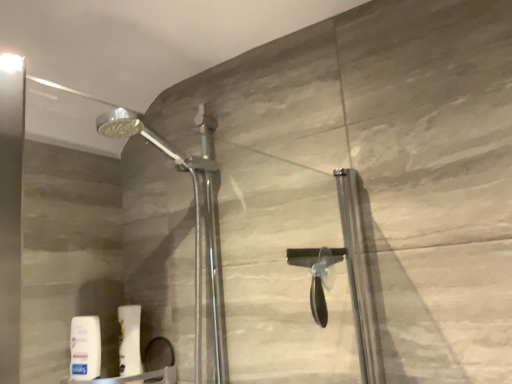
Measure the distance between point (345, 228) and camera.

37.24 inches.

This screenshot has width=512, height=384. Identify the location of transparent glass door at center. (275, 262).

In terms of width, does white matte tube at lower left, the second toiletry in the left-to-right sequence, look wider or thinner when compared to transparent glass door at center?

Considering their sizes, white matte tube at lower left, the second toiletry in the left-to-right sequence, looks slimmer than transparent glass door at center.

Is white matte tube at lower left, the second toiletry in the left-to-right sequence, with transparent glass door at center?

No, white matte tube at lower left, the second toiletry in the left-to-right sequence, is not with transparent glass door at center.

Does point (126, 322) appear closer or farther from the camera than point (149, 221)?

Clearly, point (126, 322) is closer to the camera than point (149, 221).

Is white matte tube at lower left, the first toiletry positioned from the right, positioned beyond the bounds of transparent glass door at center?

white matte tube at lower left, the first toiletry positioned from the right, is positioned outside transparent glass door at center.

Considering the relative positions of white matte tube at lower left, the first toiletry positioned from the right, and white matte lotion at lower left, which is the second toiletry in right-to-left order, in the image provided, is white matte tube at lower left, the first toiletry positioned from the right, behind white matte lotion at lower left, which is the second toiletry in right-to-left order,?

Yes, white matte tube at lower left, the first toiletry positioned from the right, is further from the camera.

From the image's perspective, which one is positioned lower, white matte tube at lower left, the second toiletry in the left-to-right sequence, or white matte lotion at lower left, which is the second toiletry in right-to-left order?

white matte lotion at lower left, which is the second toiletry in right-to-left order, is shown below in the image.

Is white matte tube at lower left, the first toiletry positioned from the right, touching white matte lotion at lower left, which is the second toiletry in right-to-left order?

Yes, the surface of white matte tube at lower left, the first toiletry positioned from the right, is in contact with white matte lotion at lower left, which is the second toiletry in right-to-left order.

Is transparent glass door at center looking in the opposite direction of white matte tube at lower left, the first toiletry positioned from the right?

Correct, transparent glass door at center is looking away from white matte tube at lower left, the first toiletry positioned from the right.

Based on the photo, from the image's perspective, is transparent glass door at center located above or below white matte tube at lower left, the second toiletry in the left-to-right sequence?

Clearly, from the image's perspective, transparent glass door at center is above white matte tube at lower left, the second toiletry in the left-to-right sequence.

From the picture: Which of these two, transparent glass door at center or white matte tube at lower left, the first toiletry positioned from the right, stands taller?

transparent glass door at center.

Considering the relative sizes of transparent glass door at center and white matte lotion at lower left, which is the second toiletry in right-to-left order, in the image provided, is transparent glass door at center smaller than white matte lotion at lower left, which is the second toiletry in right-to-left order,?

No, transparent glass door at center is not smaller than white matte lotion at lower left, which is the second toiletry in right-to-left order.

From a real-world perspective, is transparent glass door at center under white matte lotion at lower left, which is the second toiletry in right-to-left order?

No, from a real-world perspective, transparent glass door at center is not under white matte lotion at lower left, which is the second toiletry in right-to-left order.

Considering their positions, is transparent glass door at center located in front of or behind white matte lotion at lower left, which is the second toiletry in right-to-left order?

Clearly, transparent glass door at center is in front of white matte lotion at lower left, which is the second toiletry in right-to-left order.

I want to click on toiletry on the left side of white matte tube at lower left, the second toiletry in the left-to-right sequence, so click(x=85, y=348).

Which object is wider, white matte lotion at lower left, which is the second toiletry in right-to-left order, or white matte tube at lower left, the second toiletry in the left-to-right sequence?

With larger width is white matte tube at lower left, the second toiletry in the left-to-right sequence.

Does white matte lotion at lower left, which is the second toiletry in right-to-left order, contain white matte tube at lower left, the second toiletry in the left-to-right sequence?

No, white matte lotion at lower left, which is the second toiletry in right-to-left order, does not contain white matte tube at lower left, the second toiletry in the left-to-right sequence.

Is white matte lotion at lower left, arranged as the first toiletry when viewed from the left, aimed at transparent glass door at center?

No.

From a real-world perspective, between white matte lotion at lower left, which is the second toiletry in right-to-left order, and transparent glass door at center, who is vertically lower?

white matte lotion at lower left, which is the second toiletry in right-to-left order, is physically lower.

Would you say transparent glass door at center is part of white matte lotion at lower left, arranged as the first toiletry when viewed from the left,'s contents?

No, transparent glass door at center is not surrounded by white matte lotion at lower left, arranged as the first toiletry when viewed from the left.

Does white matte lotion at lower left, which is the second toiletry in right-to-left order, have a greater height compared to transparent glass door at center?

In fact, white matte lotion at lower left, which is the second toiletry in right-to-left order, may be shorter than transparent glass door at center.

This screenshot has height=384, width=512. What are the coordinates of `glass door located on the right of white matte tube at lower left, the second toiletry in the left-to-right sequence` in the screenshot? It's located at (275, 262).

Where is `toiletry that is on the left side of white matte tube at lower left, the second toiletry in the left-to-right sequence`? The width and height of the screenshot is (512, 384). toiletry that is on the left side of white matte tube at lower left, the second toiletry in the left-to-right sequence is located at coordinates (85, 348).

From the picture: From the image, which object appears to be farther from transparent glass door at center, white matte lotion at lower left, which is the second toiletry in right-to-left order, or white matte tube at lower left, the second toiletry in the left-to-right sequence?

Among the two, white matte lotion at lower left, which is the second toiletry in right-to-left order, is located further to transparent glass door at center.

When comparing their distances from white matte lotion at lower left, arranged as the first toiletry when viewed from the left, does transparent glass door at center or white matte tube at lower left, the first toiletry positioned from the right, seem closer?

white matte tube at lower left, the first toiletry positioned from the right, lies closer to white matte lotion at lower left, arranged as the first toiletry when viewed from the left, than the other object.

Based on their spatial positions, is white matte tube at lower left, the first toiletry positioned from the right, or white matte lotion at lower left, which is the second toiletry in right-to-left order, further from transparent glass door at center?

white matte lotion at lower left, which is the second toiletry in right-to-left order, is further to transparent glass door at center.

When comparing their distances from white matte tube at lower left, the second toiletry in the left-to-right sequence, does white matte lotion at lower left, which is the second toiletry in right-to-left order, or transparent glass door at center seem closer?

Among the two, white matte lotion at lower left, which is the second toiletry in right-to-left order, is located nearer to white matte tube at lower left, the second toiletry in the left-to-right sequence.

Based on the photo, which object lies nearer to the anchor point white matte lotion at lower left, which is the second toiletry in right-to-left order, white matte tube at lower left, the first toiletry positioned from the right, or transparent glass door at center?

white matte tube at lower left, the first toiletry positioned from the right, is closer to white matte lotion at lower left, which is the second toiletry in right-to-left order.

Which object lies nearer to the anchor point white matte tube at lower left, the second toiletry in the left-to-right sequence, transparent glass door at center or white matte lotion at lower left, arranged as the first toiletry when viewed from the left?

The object closer to white matte tube at lower left, the second toiletry in the left-to-right sequence, is white matte lotion at lower left, arranged as the first toiletry when viewed from the left.

This screenshot has width=512, height=384. I want to click on toiletry between transparent glass door at center and white matte tube at lower left, the second toiletry in the left-to-right sequence, in the front-back direction, so click(x=85, y=348).